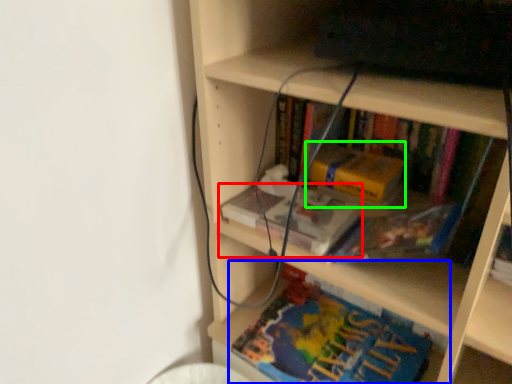
Question: Estimate the real-world distances between objects in this image. Which object is closer to book (highlighted by a red box), book (highlighted by a blue box) or paperback book (highlighted by a green box)?

Choices:
 (A) book
 (B) paperback book

Answer: (B)